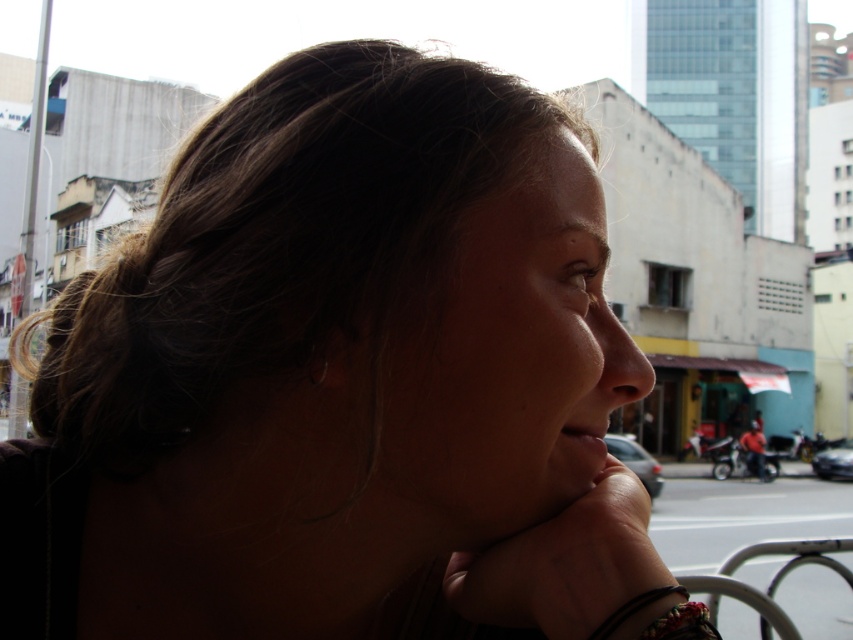
Question: Can you confirm if shiny metallic bracelet at lower right is wider than black leather bracelet at lower right?

Choices:
 (A) no
 (B) yes

Answer: (B)

Question: Which object appears farthest from the camera in this image?

Choices:
 (A) dark skin hand at lower center
 (B) shiny metallic bracelet at lower right

Answer: (A)

Question: Which of these objects is positioned closest to the black leather bracelet at lower right?

Choices:
 (A) smooth skin at lower center
 (B) silver metallic earring at upper left
 (C) shiny metallic bracelet at lower right

Answer: (C)

Question: Which point is farther to the camera?

Choices:
 (A) silver metallic earring at upper left
 (B) black leather bracelet at lower right

Answer: (B)

Question: Does shiny metallic bracelet at lower right have a larger size compared to silver metallic earring at upper left?

Choices:
 (A) no
 (B) yes

Answer: (B)

Question: Is dark skin hand at lower center bigger than black leather bracelet at lower right?

Choices:
 (A) yes
 (B) no

Answer: (A)